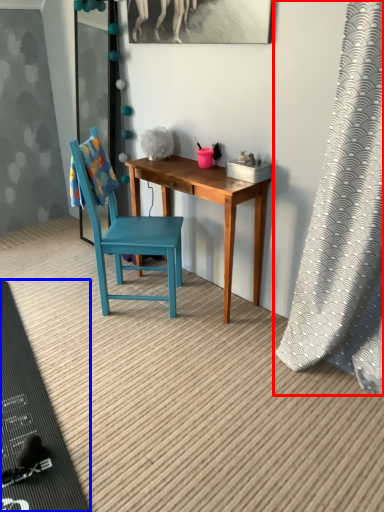
Question: Which point is further to the camera, curtain (highlighted by a red box) or mat (highlighted by a blue box)?

Choices:
 (A) curtain
 (B) mat

Answer: (B)